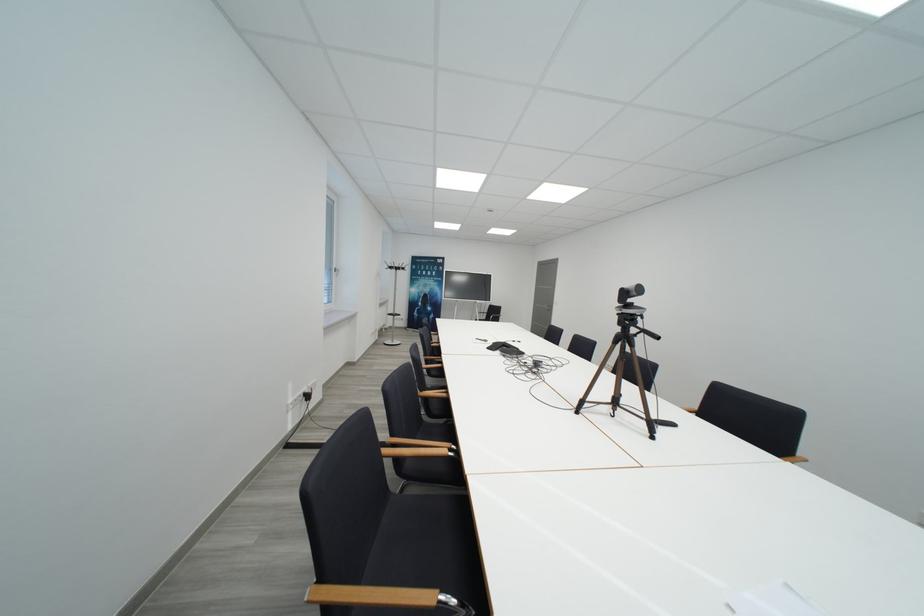
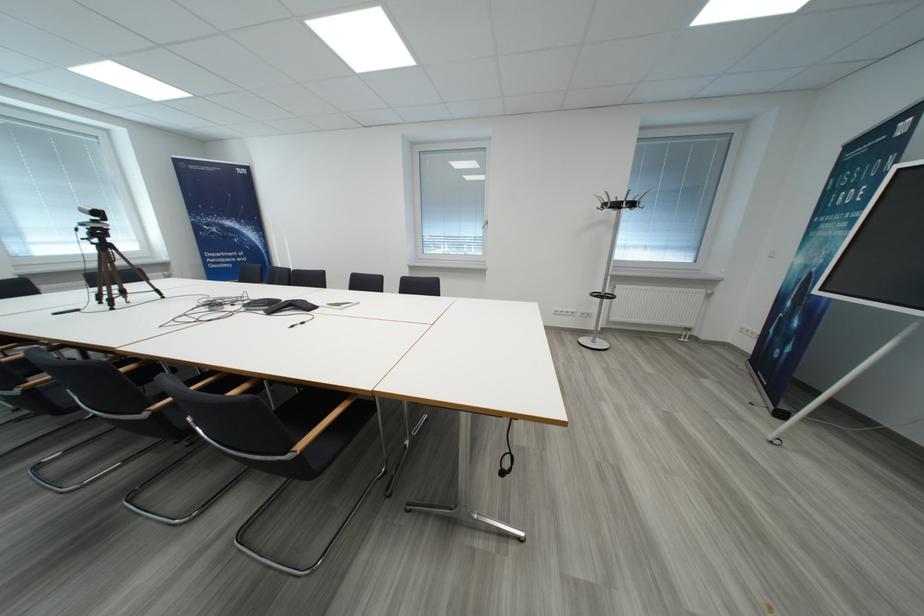
Locate, in the second image, the point that corresponds to [410,272] in the first image.

(623, 208)